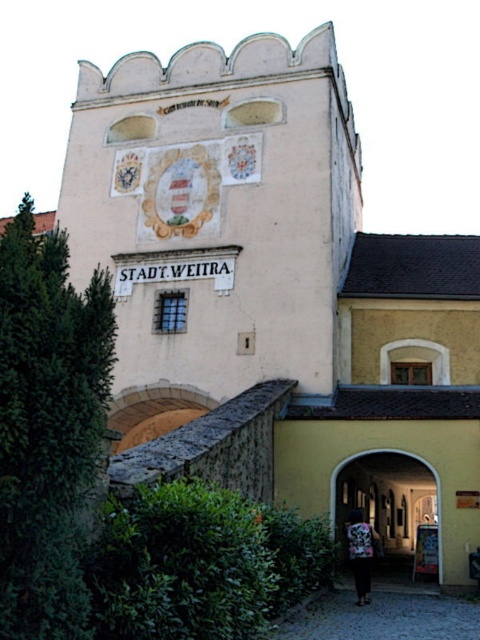
Question: Which object is closer to the camera taking this photo?

Choices:
 (A) dark fabric bag at center
 (B) matte stone archway at center

Answer: (A)

Question: Does dark fabric bag at center appear on the right side of matte stone archway at center?

Choices:
 (A) no
 (B) yes

Answer: (A)

Question: Is dark fabric bag at center closer to the viewer compared to matte stone archway at center?

Choices:
 (A) no
 (B) yes

Answer: (B)

Question: Which object is closer to the camera taking this photo?

Choices:
 (A) dark fabric bag at center
 (B) matte stone archway at center

Answer: (A)

Question: Is dark fabric bag at center wider than matte stone archway at center?

Choices:
 (A) no
 (B) yes

Answer: (A)